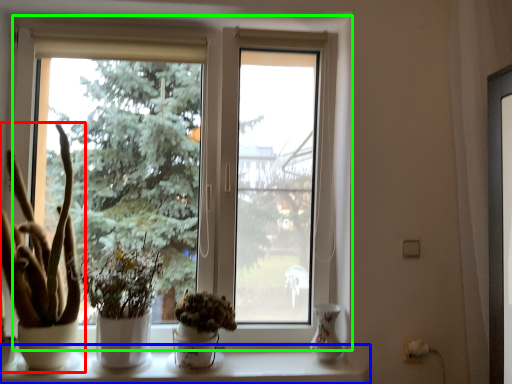
Question: Estimate the real-world distances between objects in this image. Which object is closer to houseplant (highlighted by a red box), window sill (highlighted by a blue box) or window (highlighted by a green box)?

Choices:
 (A) window sill
 (B) window

Answer: (A)